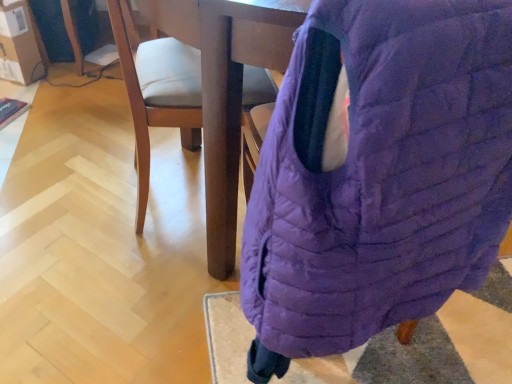
Image resolution: width=512 pixels, height=384 pixels. I want to click on free location in front of matte brown cardboard at upper left, so click(x=18, y=98).